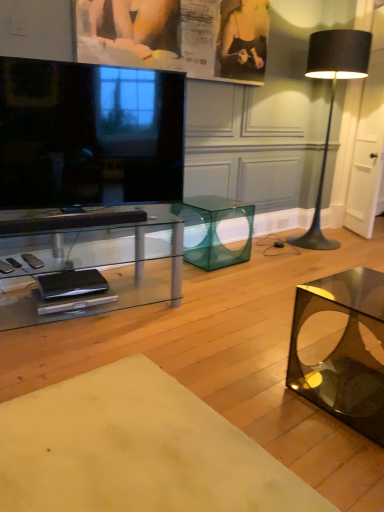
Find the location of a particular element. The height and width of the screenshot is (512, 384). vacant space that is to the left of polished black glass cube at lower right is located at coordinates (256, 393).